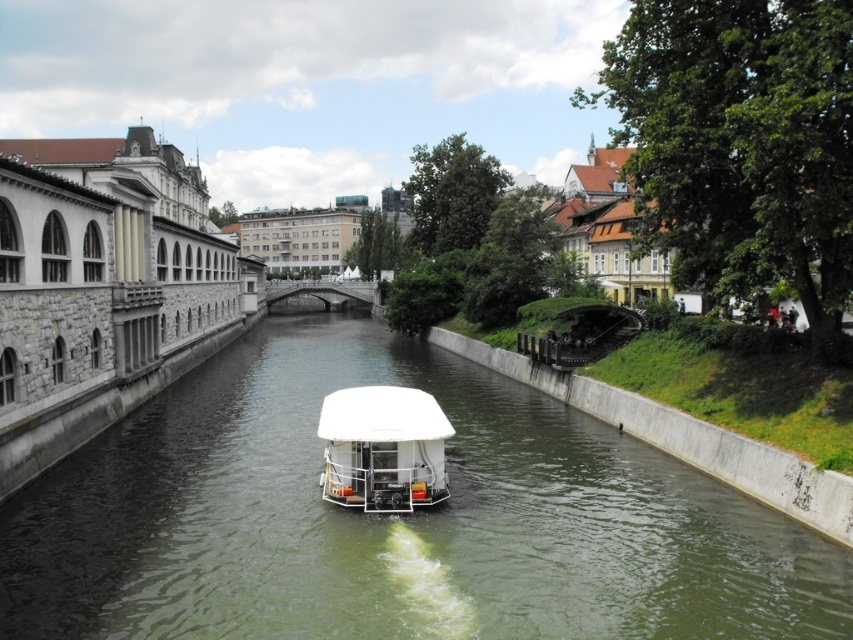
Question: Can you confirm if green concrete river at center is bigger than white matte boat at center?

Choices:
 (A) yes
 (B) no

Answer: (A)

Question: Does green concrete river at center have a greater width compared to white matte boat at center?

Choices:
 (A) no
 (B) yes

Answer: (B)

Question: Which of the following is the closest to the observer?

Choices:
 (A) (399, 438)
 (B) (276, 355)

Answer: (A)

Question: Which point appears closest to the camera in this image?

Choices:
 (A) (370, 467)
 (B) (625, 600)

Answer: (B)

Question: Does green concrete river at center appear under white matte boat at center?

Choices:
 (A) no
 (B) yes

Answer: (B)

Question: Which object is closer to the camera taking this photo?

Choices:
 (A) green concrete river at center
 (B) white matte boat at center

Answer: (A)